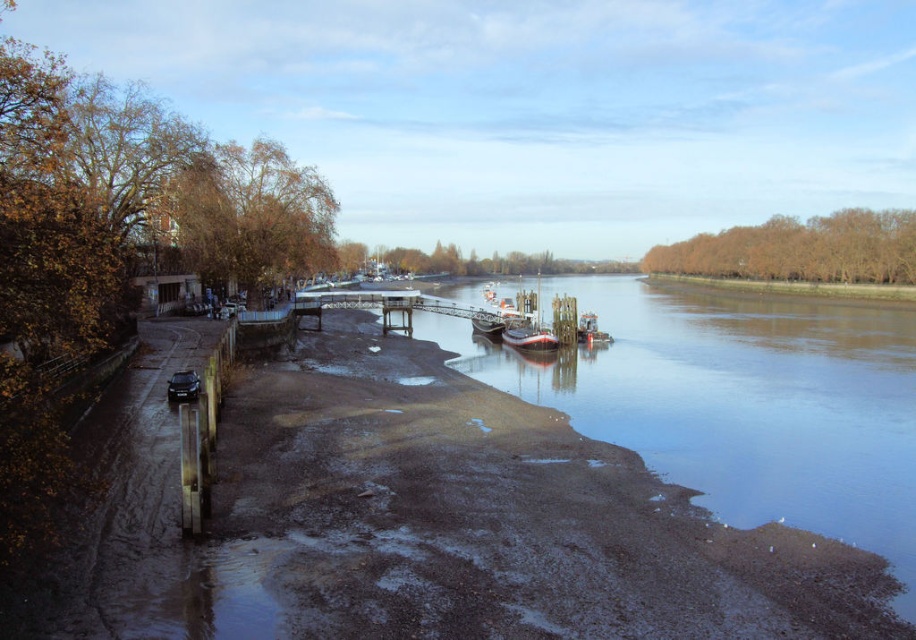
You are a photographer planning to capture the entire white wooden boat at center and the brown matte river at center in a single shot. Given the camera you have can only focus on objects within a 10 meter width, can both objects fit in the frame?

The brown matte river at center has a larger size compared to white wooden boat at center. Since the river is wider, it might exceed the 10 meter width limit, so both objects may not fit in the frame.

You are standing on the wooden pier and see both the white wooden boat at center and the white glossy boat at center. Which boat is positioned higher in the image?

The white wooden boat at center is positioned higher than the white glossy boat at center.

You are standing at the point labeled point (737, 401) in the image. What is the object located at that point?

The point (737, 401) corresponds to the brown matte river at center.